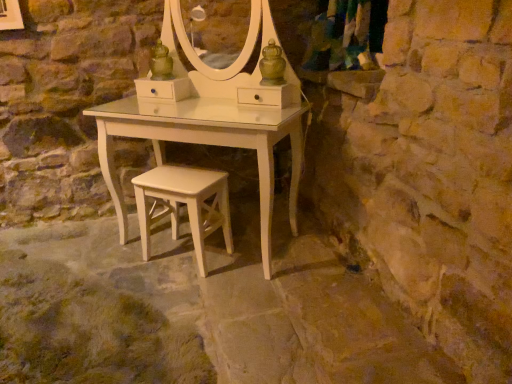
Find the location of a particular element. The image size is (512, 384). vacant space to the right of light beige wood stool at center is located at coordinates (244, 262).